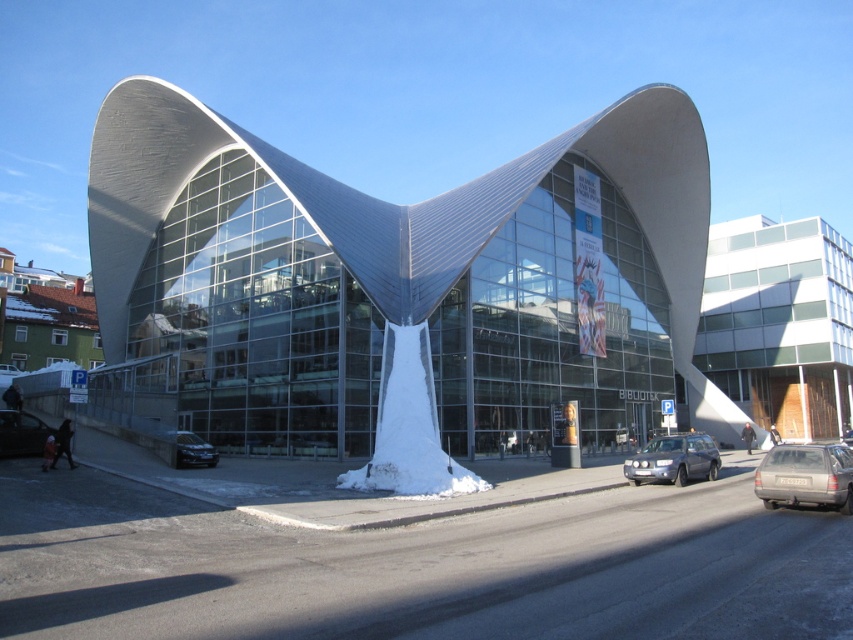
Question: Which object is the closest to the white wooden door at right?

Choices:
 (A) black matte car at lower left
 (B) satin black sedan at lower left
 (C) metallic silver suv at center

Answer: (C)

Question: Is metallic glass building at center to the left of white wooden door at right from the viewer's perspective?

Choices:
 (A) yes
 (B) no

Answer: (A)

Question: Is black matte car at lower left bigger than satin black sedan at lower left?

Choices:
 (A) yes
 (B) no

Answer: (B)

Question: Observing the image, what is the correct spatial positioning of black matte car at lower left in reference to satin black sedan at lower left?

Choices:
 (A) below
 (B) above

Answer: (B)

Question: Estimate the real-world distances between objects in this image. Which object is closer to the satin black sedan at lower left?

Choices:
 (A) white wooden door at right
 (B) black matte car at lower left

Answer: (B)

Question: Among these objects, which one is farthest from the camera?

Choices:
 (A) metallic glass building at center
 (B) black matte car at lower left

Answer: (B)